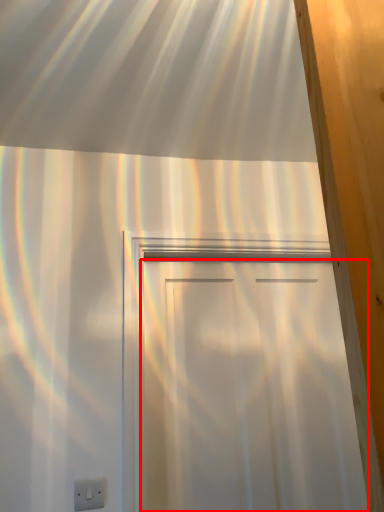
Question: From the image's perspective, where is door (annotated by the red box) located relative to electric outlet?

Choices:
 (A) below
 (B) above

Answer: (B)